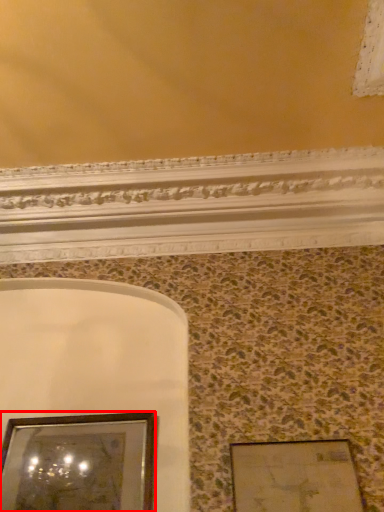
Question: From the image, what is the correct spatial relationship of picture frame (annotated by the red box) in relation to picture frame?

Choices:
 (A) right
 (B) left

Answer: (B)